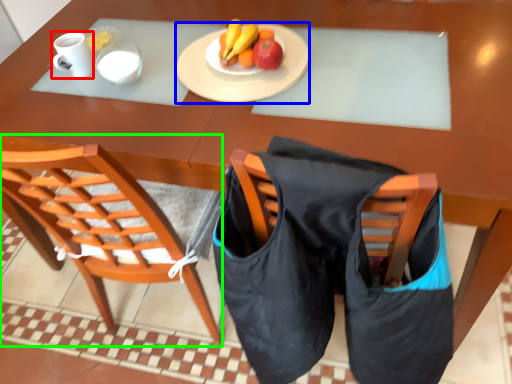
Question: Estimate the real-world distances between objects in this image. Which object is farther from coffee cup (highlighted by a red box), plate (highlighted by a blue box) or chair (highlighted by a green box)?

Choices:
 (A) plate
 (B) chair

Answer: (B)